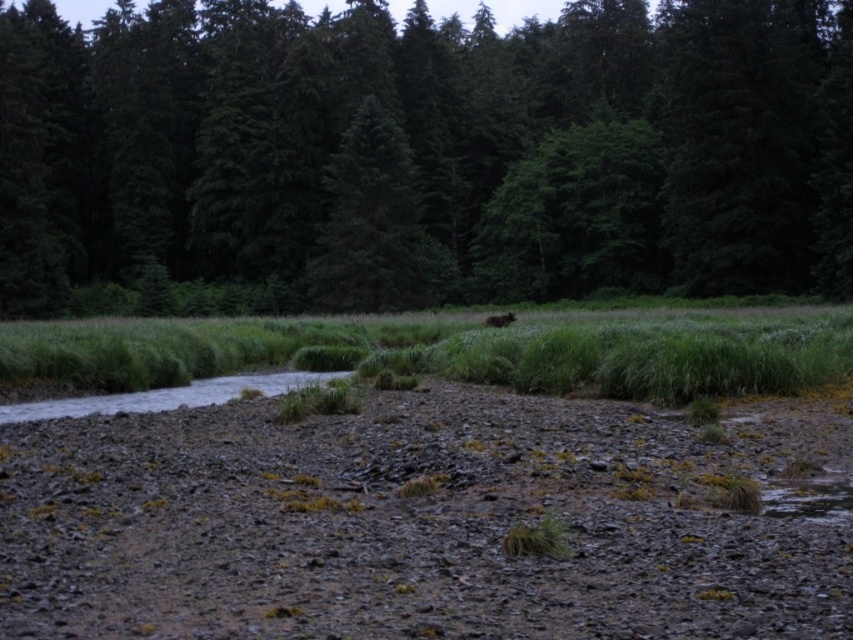
You are a hiker trying to cross the wetland area. You see the green grass at center and the green matte tree at center. Which one is taller and can provide better shelter from the rain?

The green matte tree at center is taller than the green grass at center, so it can provide better shelter from the rain.

You are standing at the point labeled point (426,150) in the image. Based on the scene description, what is the nearest object to you?

The nearest object to you is the green matte tree at upper center because the point (426,150) is on it.